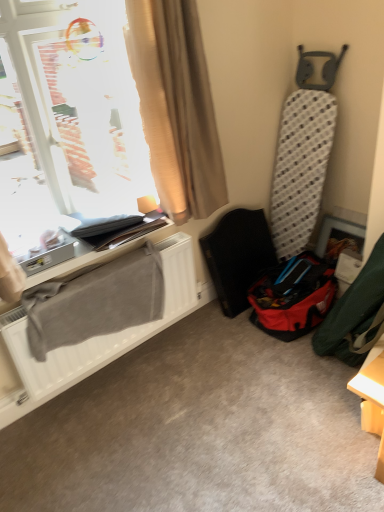
Question: Can you confirm if red fabric bag at lower right is taller than transparent glass window at upper left?

Choices:
 (A) no
 (B) yes

Answer: (A)

Question: Are red fabric bag at lower right and transparent glass window at upper left far apart?

Choices:
 (A) no
 (B) yes

Answer: (B)

Question: Considering the relative sizes of red fabric bag at lower right and transparent glass window at upper left in the image provided, is red fabric bag at lower right smaller than transparent glass window at upper left?

Choices:
 (A) no
 (B) yes

Answer: (B)

Question: From the image's perspective, is red fabric bag at lower right above transparent glass window at upper left?

Choices:
 (A) no
 (B) yes

Answer: (A)

Question: From a real-world perspective, is red fabric bag at lower right over transparent glass window at upper left?

Choices:
 (A) no
 (B) yes

Answer: (A)

Question: Is the position of red fabric bag at lower right more distant than that of transparent glass window at upper left?

Choices:
 (A) yes
 (B) no

Answer: (A)

Question: Is plastic textured folding chair at center right surrounded by transparent glass window at upper left?

Choices:
 (A) no
 (B) yes

Answer: (A)

Question: Does transparent glass window at upper left come in front of plastic textured folding chair at center right?

Choices:
 (A) yes
 (B) no

Answer: (A)

Question: Is transparent glass window at upper left facing away from plastic textured folding chair at center right?

Choices:
 (A) no
 (B) yes

Answer: (A)

Question: From the image's perspective, is transparent glass window at upper left located beneath plastic textured folding chair at center right?

Choices:
 (A) yes
 (B) no

Answer: (B)

Question: Does transparent glass window at upper left have a greater width compared to plastic textured folding chair at center right?

Choices:
 (A) no
 (B) yes

Answer: (B)

Question: Is transparent glass window at upper left next to plastic textured folding chair at center right?

Choices:
 (A) yes
 (B) no

Answer: (B)

Question: Is plastic textured folding chair at center right further to camera compared to red fabric bag at lower right?

Choices:
 (A) yes
 (B) no

Answer: (A)